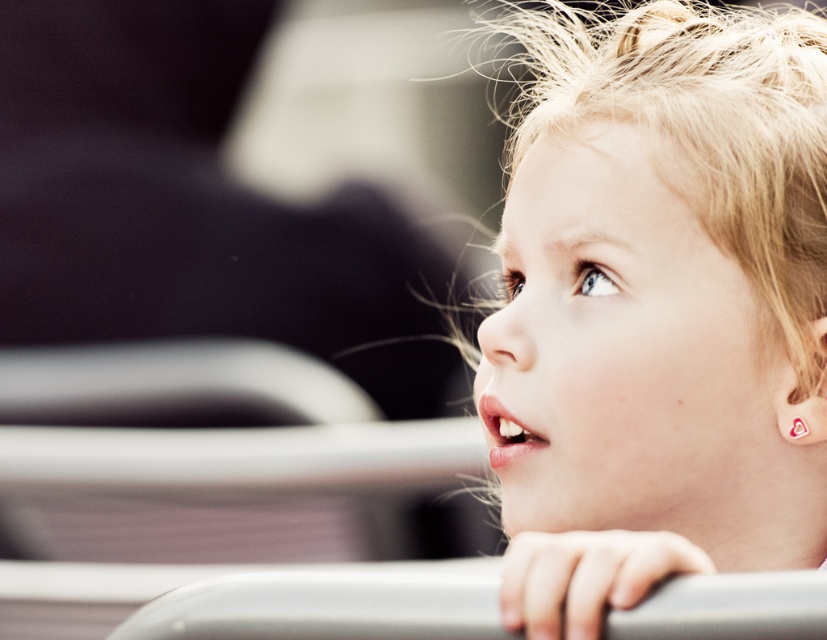
You are a photographer trying to capture the child in the image. If you want to adjust your focus to include both the pale blonde hair at upper right and the gray rubber rail at lower center, which object should you focus on first to ensure both are in focus?

The gray rubber rail at lower center is behind the pale blonde hair at upper right, so you should focus on the gray rubber rail at lower center first to ensure both are in focus.

You are a photographer adjusting your camera settings. The subject is the child in the image, and you need to focus on the point at point (763, 458). If your camera has a depth of field range of 25 inches, will the focus point be within the acceptable range?

The point (763, 458) is 33.30 inches from the viewer. Since the depth of field range is 25 inches, the focus point is outside the acceptable range and may not be in focus.

From the picture: You are a photographer adjusting the focus on your camera. You notice two points in the image, point 1 at coordinates point (675, 236) and point 2 at coordinates point (343, 630). Which point is closer to the camera lens?

Point 1 at coordinates point (675, 236) is closer to the camera lens than point 2 at coordinates point (343, 630) because it is further to the viewer.